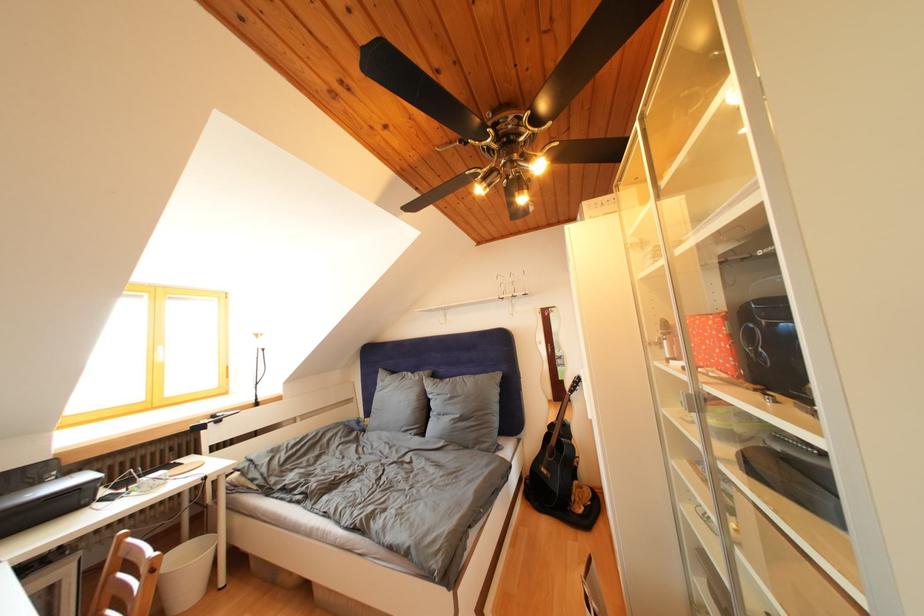
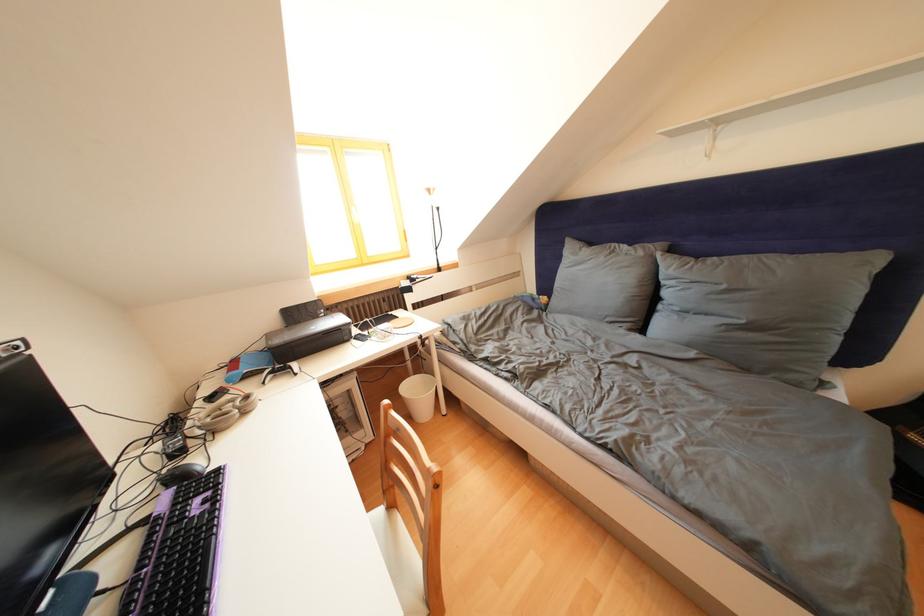
Find the pixel in the second image that matches pixel 426 383 in the first image.

(649, 259)